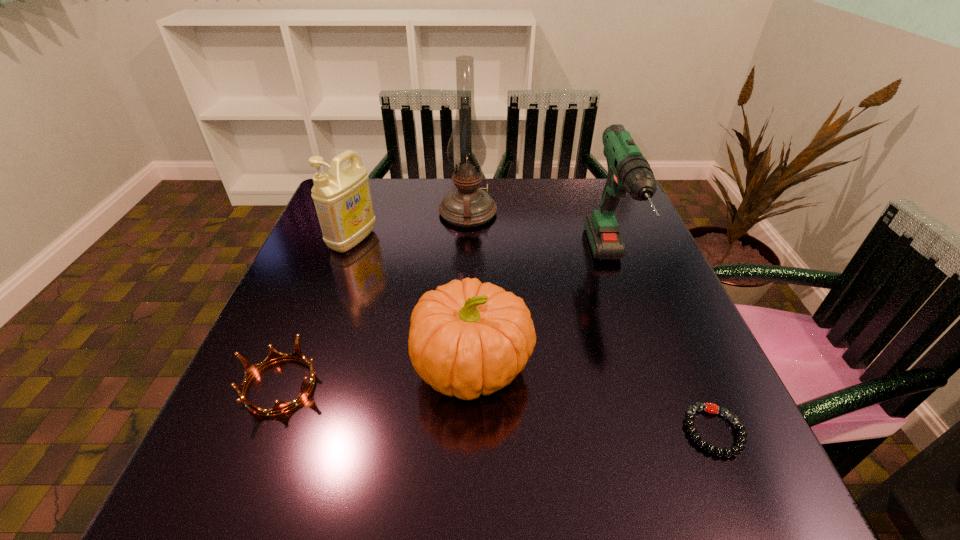
At what (x,y) coordinates should I click in order to perform the action: click on vacant area located on the right of the crown. Please return your answer as a coordinate pair (x, y). The image size is (960, 540). Looking at the image, I should click on (547, 386).

At what (x,y) coordinates should I click in order to perform the action: click on free spot located on the left of the bracelet. Please return your answer as a coordinate pair (x, y). Image resolution: width=960 pixels, height=540 pixels. Looking at the image, I should click on (542, 431).

You are a GUI agent. You are given a task and a screenshot of the screen. Output one action in this format:
    pyautogui.click(x=<x>, y=<y>)
    Task: Click on the object located in the far edge section of the desktop
    The image size is (960, 540).
    Given the screenshot: What is the action you would take?
    pyautogui.click(x=467, y=206)

I want to click on object positioned at the near edge, so click(711, 408).

Where is `detergent present at the left edge`? The image size is (960, 540). detergent present at the left edge is located at coordinates (342, 198).

Locate an element on the screen. Image resolution: width=960 pixels, height=540 pixels. crown located at the left edge is located at coordinates (251, 370).

Identify the location of drill located at the right edge. This screenshot has width=960, height=540. pyautogui.click(x=628, y=170).

Find the location of a particular element. This screenshot has width=960, height=540. bracelet located in the right edge section of the desktop is located at coordinates (711, 408).

Where is `object situated at the near right corner`? This screenshot has width=960, height=540. object situated at the near right corner is located at coordinates (711, 408).

In the image, there is a desktop. Where is `vacant space at the far edge`? This screenshot has width=960, height=540. vacant space at the far edge is located at coordinates (516, 188).